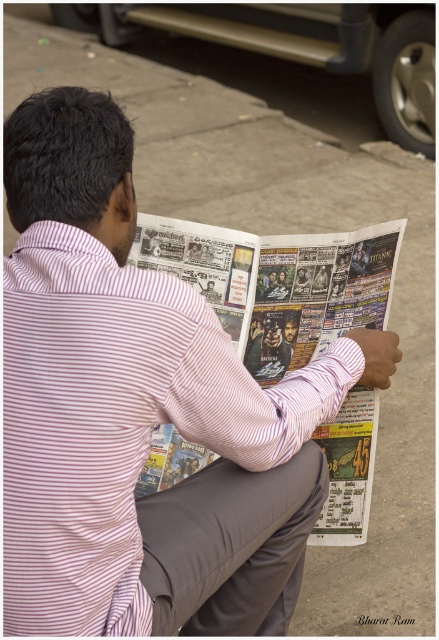
Between printed newspaper at center and gray cotton pants at lower center, which one has more height?

printed newspaper at center is taller.

Is printed newspaper at center shorter than gray cotton pants at lower center?

Incorrect, printed newspaper at center's height does not fall short of gray cotton pants at lower center's.

Is point (308, 308) positioned after point (161, 625)?

Yes, it is.

Find the location of a particular element. printed newspaper at center is located at coordinates (277, 284).